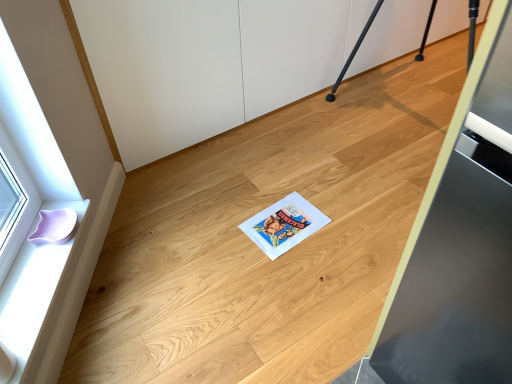
Locate an element on the screen. vacant area that lies in front of white paper comic book at center is located at coordinates (289, 280).